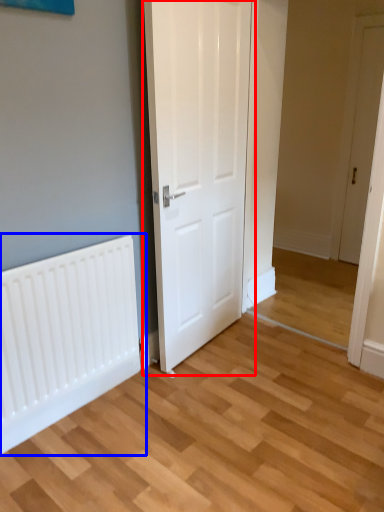
Question: Which object is closer to the camera taking this photo, door (highlighted by a red box) or radiator (highlighted by a blue box)?

Choices:
 (A) door
 (B) radiator

Answer: (A)